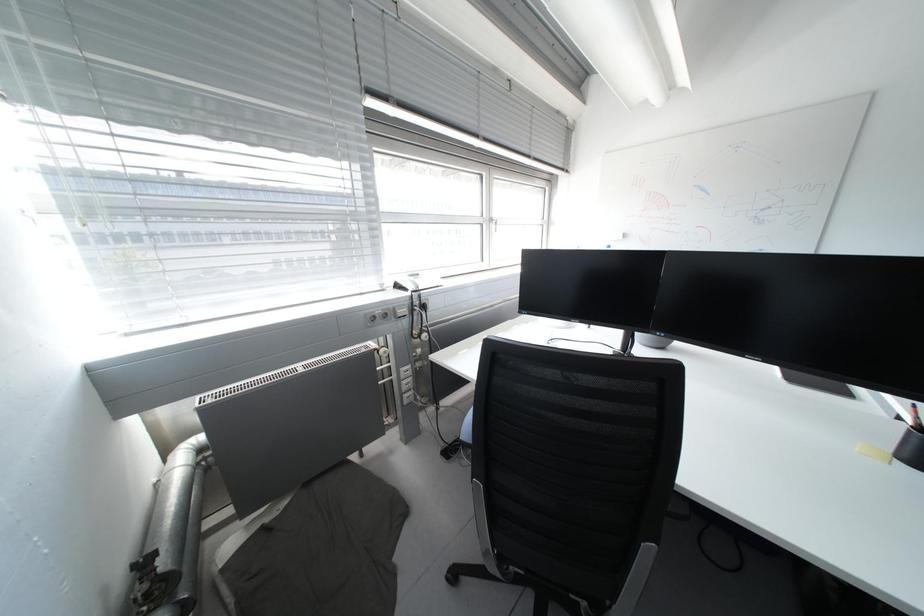
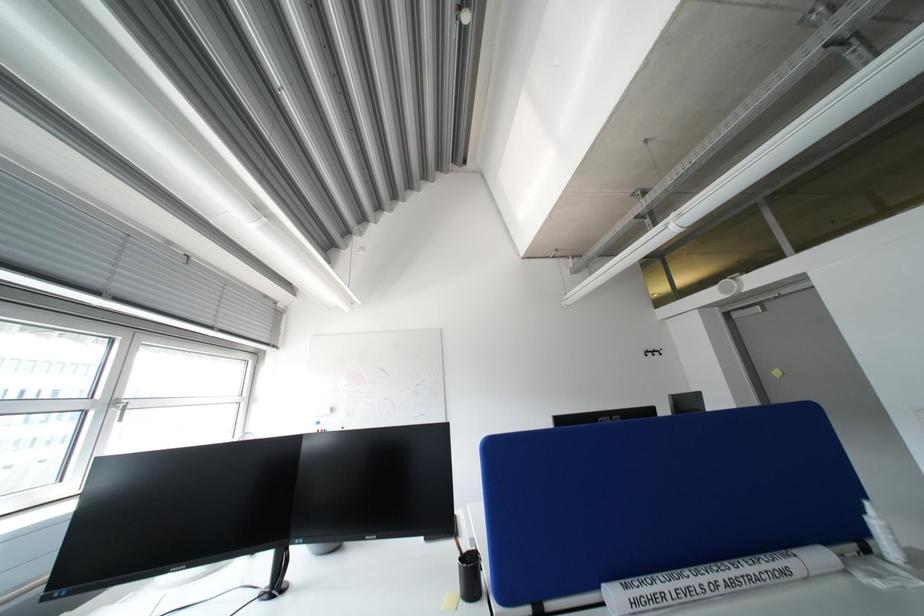
How did the camera likely rotate?

The camera rotated toward right-up.